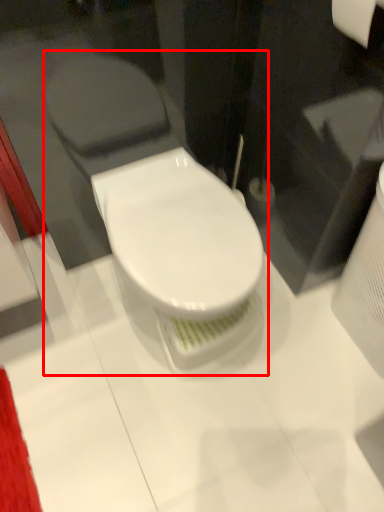
Question: From the image's perspective, what is the correct spatial relationship of toilet (annotated by the red box) in relation to toilet paper?

Choices:
 (A) below
 (B) above

Answer: (A)